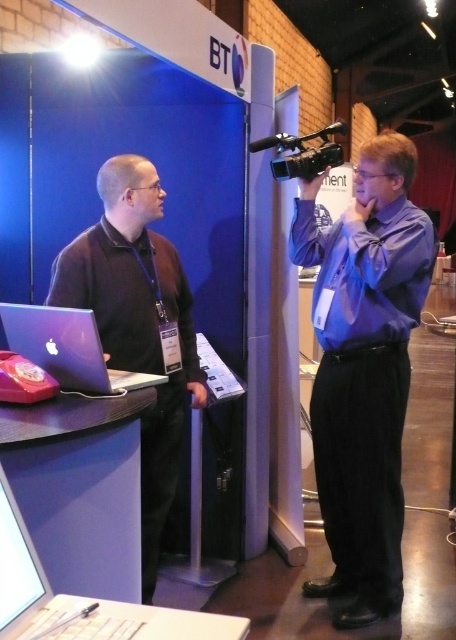
Where is `blue smooth shirt at right`? This screenshot has height=640, width=456. blue smooth shirt at right is located at coordinates (363, 369).

Is point (368, 387) more distant than point (70, 333)?

That is True.

Who is more forward, (x=336, y=257) or (x=36, y=360)?

Point (x=36, y=360) is in front.

At what (x,y) coordinates should I click in order to perform the action: click on blue smooth shirt at right. Please return your answer as a coordinate pair (x, y). This screenshot has width=456, height=640. Looking at the image, I should click on (363, 369).

Based on the photo, is blue smooth shirt at right above silver metallic laptop at lower left?

Yes.

Is the position of blue smooth shirt at right less distant than that of silver metallic laptop at lower left?

No, it is not.

Between point (342, 589) and point (25, 627), which one is positioned in front?

Point (25, 627) is in front.

You are a GUI agent. You are given a task and a screenshot of the screen. Output one action in this format:
    pyautogui.click(x=<x>, y=<y>)
    Task: Click on the blue smooth shirt at right
    
    Given the screenshot: What is the action you would take?
    pyautogui.click(x=363, y=369)

Is matte black laptop at left positioned in front of matte silver laptop at left?

No, matte black laptop at left is further to the viewer.

Which is below, matte black laptop at left or matte silver laptop at left?

matte black laptop at left

Between point (145, 310) and point (130, 385), which one is positioned in front?

Positioned in front is point (130, 385).

Where is `matte black laptop at left`? Image resolution: width=456 pixels, height=640 pixels. matte black laptop at left is located at coordinates (138, 324).